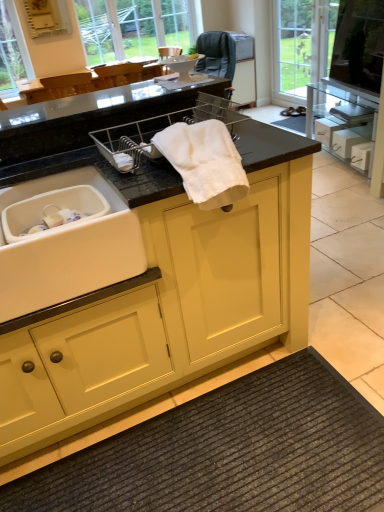
Question: In terms of height, does clear glass window at upper center look taller or shorter compared to white cotton towel at center?

Choices:
 (A) short
 (B) tall

Answer: (B)

Question: Choose the correct answer: Is clear glass window at upper center inside white cotton towel at center or outside it?

Choices:
 (A) outside
 (B) inside

Answer: (A)

Question: Considering the real-world distances, which object is farthest from the matte yellow cabinet at center?

Choices:
 (A) transparent glass door at upper right
 (B) dark gray textured bath mat at lower center
 (C) transparent glass tv at upper right
 (D) white cotton towel at center
 (E) white matte drawer at right

Answer: (A)

Question: Which is nearer to the clear glass window at upper center?

Choices:
 (A) transparent glass tv at upper right
 (B) white matte drawer at right
 (C) transparent glass door at upper right
 (D) matte yellow cabinet at center
 (E) white matte sink at lower left

Answer: (C)